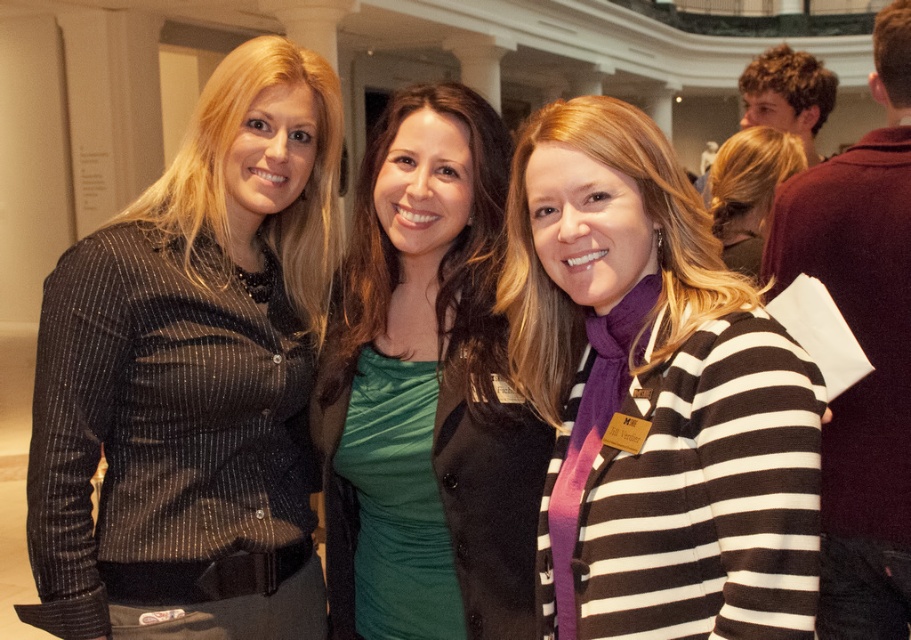
You are a fashion designer observing the three women in the image. You need to determine which of the two black garments, the matte black blouse at left or the matte black shirt at center, would require less fabric to produce. Based on their sizes, which one would need less material?

The matte black blouse at left is smaller than the matte black shirt at center, so it would require less fabric to produce.

Based on the photo, you are a photographer setting up a shoot in a room with three women. You need to place a small prop between the striped sweater at center and the matte black shirt at center. Given their sizes, where should you position the prop to ensure it fits comfortably between them?

The striped sweater at center is thinner than the matte black shirt at center, so placing the prop closer to the thinner striped sweater at center would allow it to fit comfortably between them.